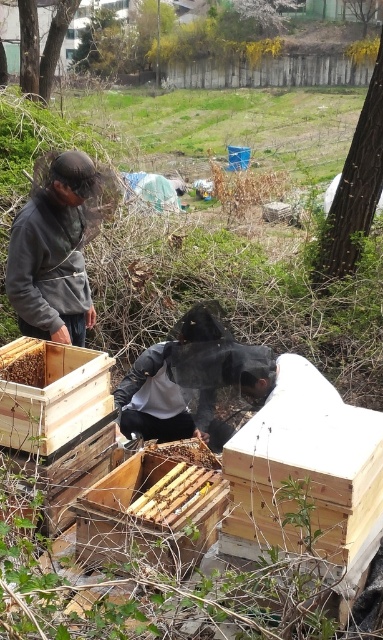
Looking at this image, is brown wooden beehive at lower left closer to camera compared to brown wooden bee at center?

Yes, brown wooden beehive at lower left is closer to the viewer.

Which is behind, point (31, 368) or point (206, 445)?

The point (206, 445) is more distant.

What are the coordinates of `brown wooden beehive at lower left` in the screenshot? It's located at (24, 364).

Where is `brown wooden beehive at lower left`? This screenshot has height=640, width=383. brown wooden beehive at lower left is located at coordinates (24, 364).

Describe the element at coordinates (50, 394) in the screenshot. I see `wooden beehive at lower left` at that location.

Is wooden beehive at lower left to the left of brown wooden bee at center from the viewer's perspective?

Yes, wooden beehive at lower left is to the left of brown wooden bee at center.

The height and width of the screenshot is (640, 383). I want to click on wooden beehive at lower left, so [50, 394].

Is wooden beehive at center wider than wooden beehive at lower left?

Yes, wooden beehive at center is wider than wooden beehive at lower left.

Between wooden beehive at center and wooden beehive at lower left, which one appears on the right side from the viewer's perspective?

wooden beehive at center is more to the right.

Between point (157, 531) and point (8, 355), which one is positioned in front?

Positioned in front is point (157, 531).

Where is `wooden beehive at center`? wooden beehive at center is located at coordinates (150, 513).